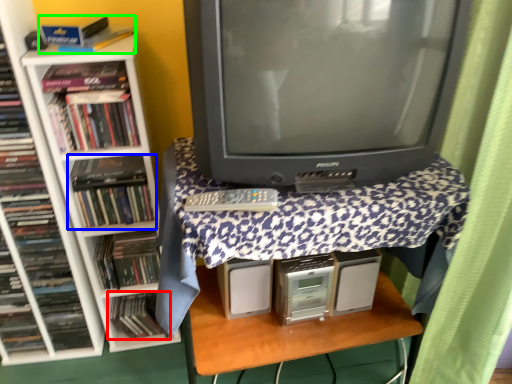
Question: Considering the real-world distances, which object is closest to book (highlighted by a red box)? book (highlighted by a blue box) or book (highlighted by a green box).

Choices:
 (A) book
 (B) book

Answer: (A)